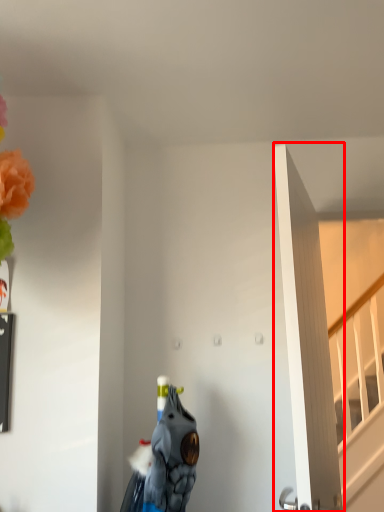
Question: From the image's perspective, where is door (annotated by the red box) located relative to animal?

Choices:
 (A) below
 (B) above

Answer: (B)